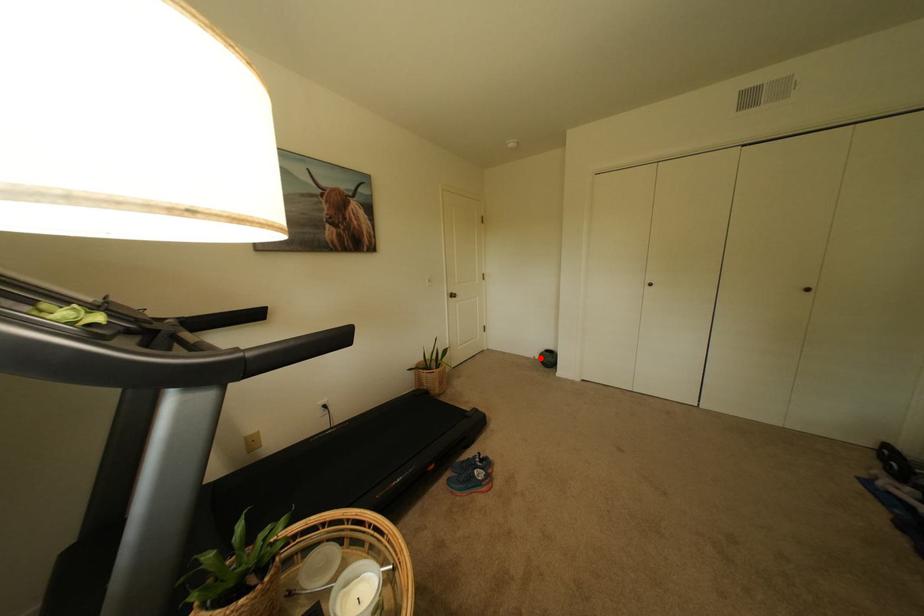
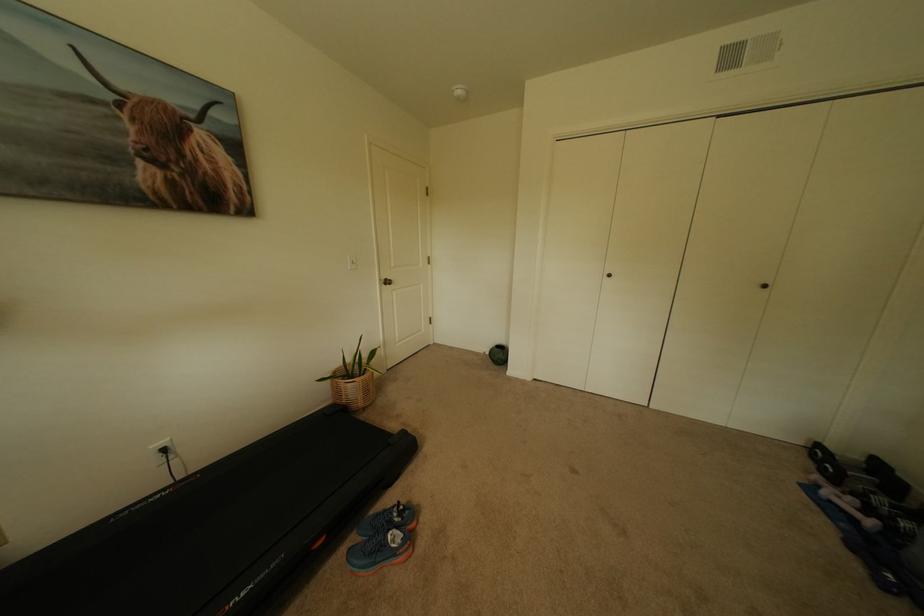
Question: I am providing you with two images of the same scene from different viewpoints. In image1, a red point is highlighted. Considering the same 3D point in image2, which of the following is correct?

Choices:
 (A) It is closer
 (B) It is farther

Answer: (B)